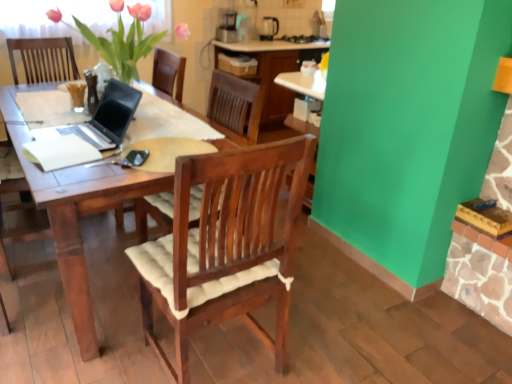
Question: From the image's perspective, is matte black coffee maker at upper center under pink matte vase at upper left?

Choices:
 (A) yes
 (B) no

Answer: (B)

Question: Is matte black coffee maker at upper center aimed at pink matte vase at upper left?

Choices:
 (A) no
 (B) yes

Answer: (A)

Question: Is matte black coffee maker at upper center not near pink matte vase at upper left?

Choices:
 (A) no
 (B) yes

Answer: (B)

Question: Does matte black coffee maker at upper center appear on the right side of pink matte vase at upper left?

Choices:
 (A) yes
 (B) no

Answer: (A)

Question: Is matte black coffee maker at upper center turned away from pink matte vase at upper left?

Choices:
 (A) yes
 (B) no

Answer: (B)

Question: In the image, is matte black laptop at left positioned in front of or behind matte black coffee maker at upper center?

Choices:
 (A) behind
 (B) front

Answer: (B)

Question: Is matte black laptop at left situated inside matte black coffee maker at upper center or outside?

Choices:
 (A) inside
 (B) outside

Answer: (B)

Question: From a real-world perspective, is matte black laptop at left positioned above or below matte black coffee maker at upper center?

Choices:
 (A) above
 (B) below

Answer: (B)

Question: In terms of size, does matte black laptop at left appear bigger or smaller than matte black coffee maker at upper center?

Choices:
 (A) big
 (B) small

Answer: (A)

Question: From the image's perspective, is wooden laptop at left located above or below white paper at center?

Choices:
 (A) below
 (B) above

Answer: (B)

Question: Considering their positions, is wooden laptop at left located in front of or behind white paper at center?

Choices:
 (A) behind
 (B) front

Answer: (A)

Question: Visually, is wooden laptop at left positioned to the left or to the right of white paper at center?

Choices:
 (A) left
 (B) right

Answer: (A)

Question: Is wooden laptop at left wider or thinner than white paper at center?

Choices:
 (A) thin
 (B) wide

Answer: (B)

Question: Based on their sizes in the image, would you say white paper at center is bigger or smaller than pink matte vase at upper left?

Choices:
 (A) small
 (B) big

Answer: (A)

Question: Considering the positions of point (53, 167) and point (136, 36), is point (53, 167) closer or farther from the camera than point (136, 36)?

Choices:
 (A) farther
 (B) closer

Answer: (B)